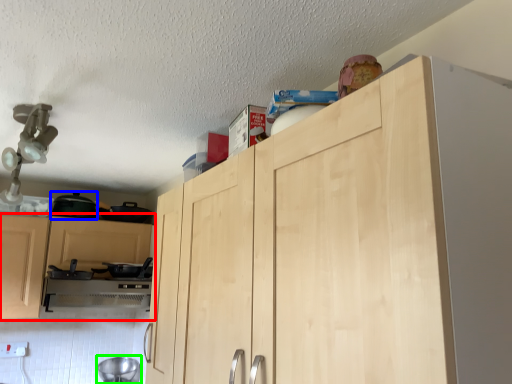
Question: Estimate the real-world distances between objects in this image. Which object is farther from cabinetry (highlighted by a red box), appliance (highlighted by a blue box) or appliance (highlighted by a green box)?

Choices:
 (A) appliance
 (B) appliance

Answer: (B)